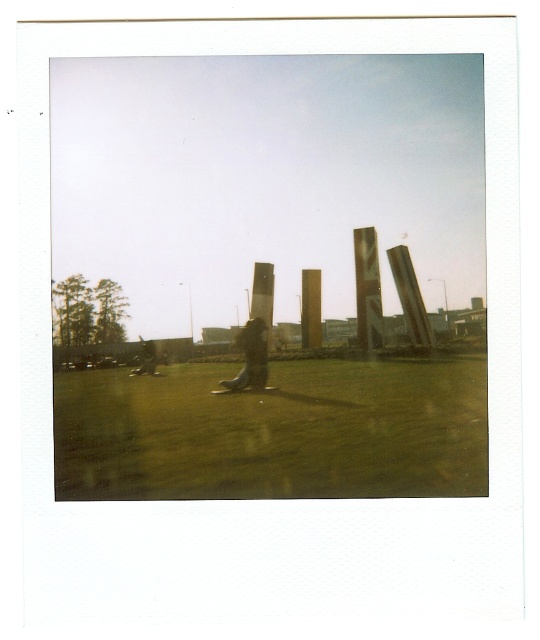
Is bronze textured pillar at center above gold polished pillar at center?

No.

Is bronze textured pillar at center taller than gold polished pillar at center?

In fact, bronze textured pillar at center may be shorter than gold polished pillar at center.

Between point (357, 292) and point (320, 337), which one is positioned in front?

Positioned in front is point (357, 292).

This screenshot has width=540, height=640. In order to click on bronze textured pillar at center in this screenshot , I will do `click(367, 289)`.

Is bronze textured pillar at center wider than leather boots at center?

No, bronze textured pillar at center is not wider than leather boots at center.

Identify the location of bronze textured pillar at center. (367, 289).

Does leather boots at center appear over gold polished pillar at center?

Actually, leather boots at center is below gold polished pillar at center.

Can you confirm if leather boots at center is smaller than gold polished pillar at center?

Actually, leather boots at center might be larger than gold polished pillar at center.

Between point (259, 348) and point (303, 337), which one is positioned behind?

The point (303, 337) is behind.

At what (x,y) coordinates should I click in order to perform the action: click on leather boots at center. Please return your answer as a coordinate pair (x, y). Looking at the image, I should click on (251, 356).